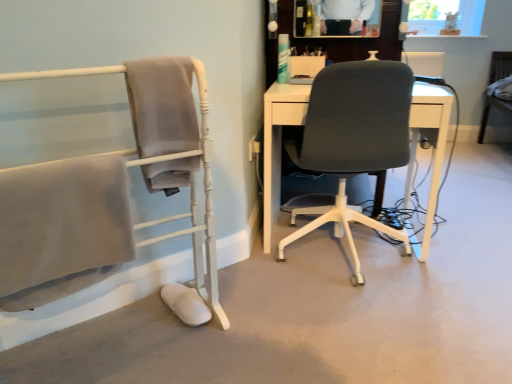
Question: From the image's perspective, is dark gray fabric office chair at center, the second chair positioned from the right, located above wooden chair at right, the third chair when ordered from front to back?

Choices:
 (A) yes
 (B) no

Answer: (B)

Question: Does dark gray fabric office chair at center, which is the second chair in front-to-back order, have a lesser width compared to wooden chair at right, the first chair viewed from the back?

Choices:
 (A) no
 (B) yes

Answer: (A)

Question: From the image's perspective, is dark gray fabric office chair at center, the second chair positioned from the right, below wooden chair at right, the first chair viewed from the back?

Choices:
 (A) no
 (B) yes

Answer: (B)

Question: Is dark gray fabric office chair at center, the second chair positioned from the right, at the left side of wooden chair at right, the third chair when ordered from front to back?

Choices:
 (A) yes
 (B) no

Answer: (A)

Question: Is dark gray fabric office chair at center, arranged as the 2th chair when viewed from the left, outside of wooden chair at right, placed as the 1th chair when sorted from right to left?

Choices:
 (A) no
 (B) yes

Answer: (B)

Question: Do you think wooden chair at right, the first chair viewed from the back, is within dark gray fabric office chair at center, which is the second chair in front-to-back order, or outside of it?

Choices:
 (A) outside
 (B) inside

Answer: (A)

Question: Visually, is wooden chair at right, the first chair viewed from the back, positioned to the left or to the right of dark gray fabric office chair at center, which is the second chair in back-to-front order?

Choices:
 (A) right
 (B) left

Answer: (A)

Question: Looking at their shapes, would you say wooden chair at right, the third chair when ordered from front to back, is wider or thinner than dark gray fabric office chair at center, which is the second chair in front-to-back order?

Choices:
 (A) wide
 (B) thin

Answer: (B)

Question: In the image, is wooden chair at right, placed as the 1th chair when sorted from right to left, positioned in front of or behind dark gray fabric office chair at center, the second chair positioned from the right?

Choices:
 (A) behind
 (B) front

Answer: (A)

Question: In terms of size, does wooden chair at right, placed as the 1th chair when sorted from right to left, appear bigger or smaller than matte gray chair at left, which is the first chair in left-to-right order?

Choices:
 (A) big
 (B) small

Answer: (A)

Question: In terms of width, does wooden chair at right, the third chair when ordered from front to back, look wider or thinner when compared to matte gray chair at left, which appears as the third chair when viewed from the right?

Choices:
 (A) wide
 (B) thin

Answer: (A)

Question: Does point (482, 132) appear closer or farther from the camera than point (0, 246)?

Choices:
 (A) closer
 (B) farther

Answer: (B)

Question: Considering the relative positions of wooden chair at right, the first chair viewed from the back, and matte gray chair at left, which appears as the third chair when viewed from the right, in the image provided, is wooden chair at right, the first chair viewed from the back, to the left or to the right of matte gray chair at left, which appears as the third chair when viewed from the right,?

Choices:
 (A) right
 (B) left

Answer: (A)

Question: Visually, is matte gray chair at left, positioned as the third chair in back-to-front order, positioned to the left or to the right of dark gray fabric office chair at center, the second chair positioned from the right?

Choices:
 (A) left
 (B) right

Answer: (A)

Question: In terms of width, does matte gray chair at left, positioned as the third chair in back-to-front order, look wider or thinner when compared to dark gray fabric office chair at center, the second chair positioned from the right?

Choices:
 (A) thin
 (B) wide

Answer: (A)